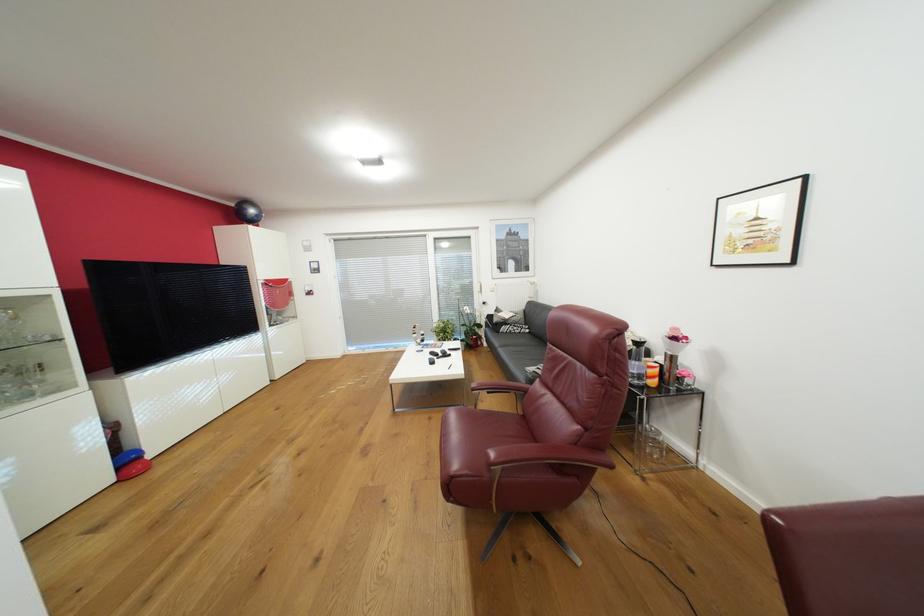
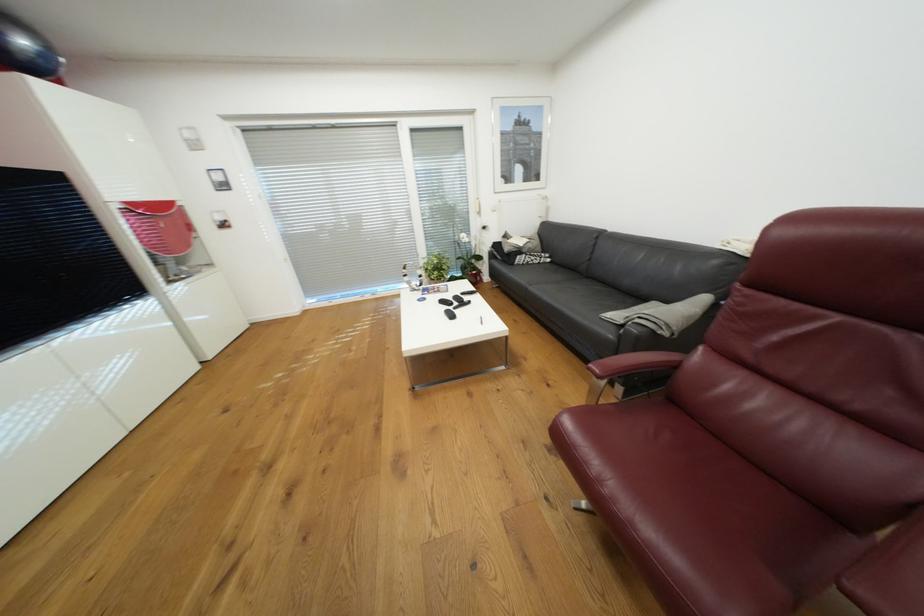
The images are taken continuously from a first-person perspective. In which direction are you moving?

The cameraman moved toward left, forward.